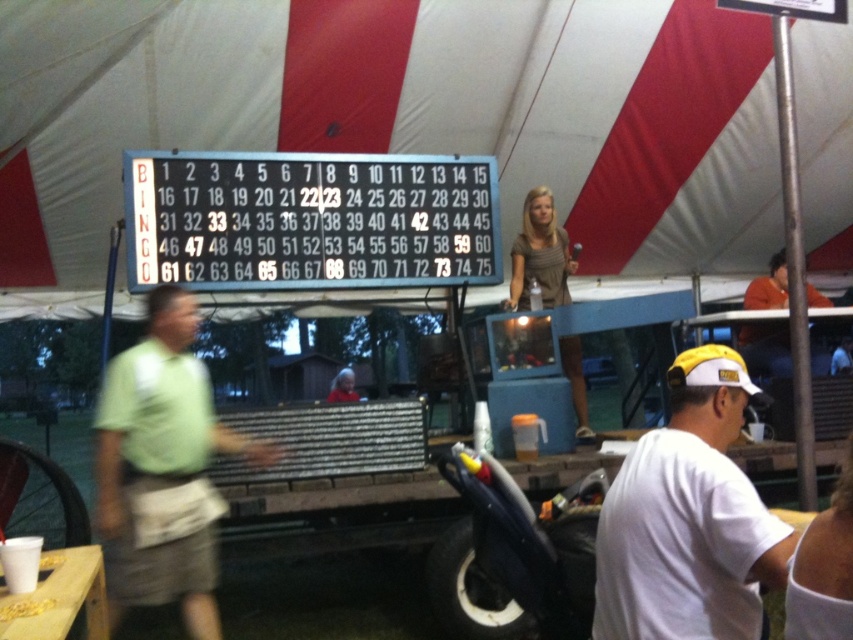
Question: Which point appears farthest from the camera in this image?

Choices:
 (A) (654, 612)
 (B) (546, 225)
 (C) (119, 616)

Answer: (B)

Question: Is white cotton shirt at lower right positioned in front of matte gray dress at center?

Choices:
 (A) no
 (B) yes

Answer: (B)

Question: Is blue plastic scoreboard at center smaller than green fabric shirt at left?

Choices:
 (A) yes
 (B) no

Answer: (A)

Question: Which is nearer to the matte gray dress at center?

Choices:
 (A) blue plastic scoreboard at center
 (B) green fabric shirt at left

Answer: (A)

Question: Which point is closer to the camera taking this photo?

Choices:
 (A) pos(102,403)
 (B) pos(697,428)

Answer: (B)

Question: Does blue plastic scoreboard at center lie behind white cotton shirt at lower right?

Choices:
 (A) yes
 (B) no

Answer: (A)